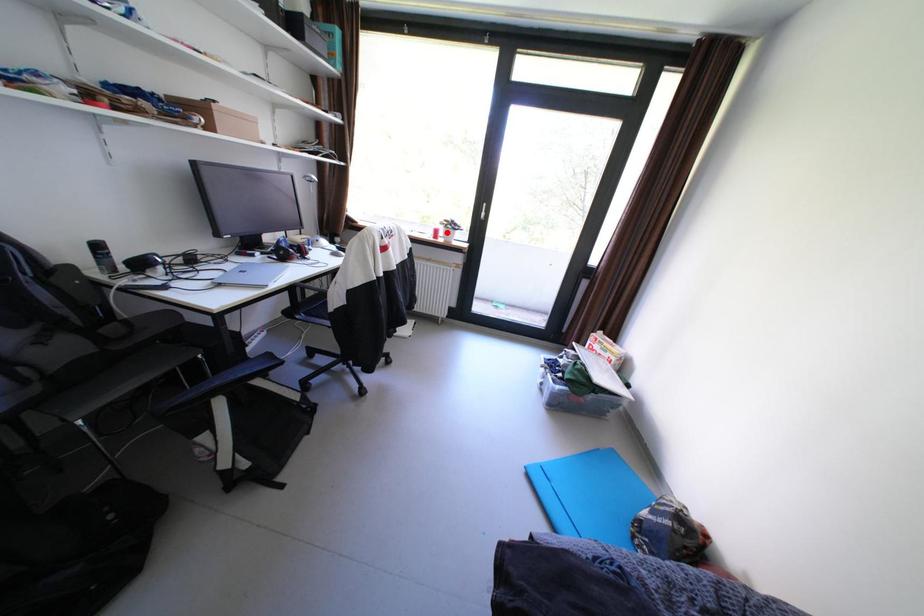
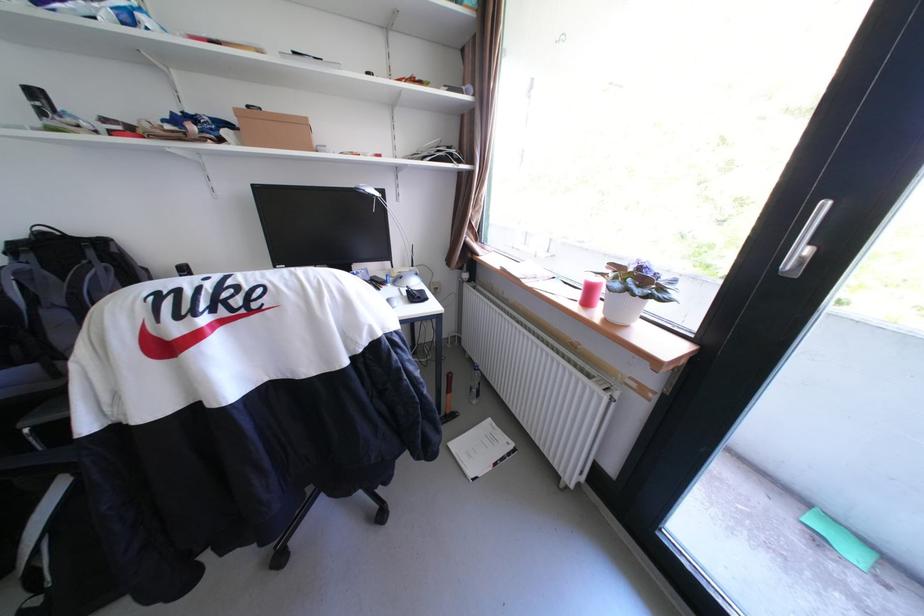
The point at the highlighted location is marked in the first image. Where is the corresponding point in the second image?

(601, 291)